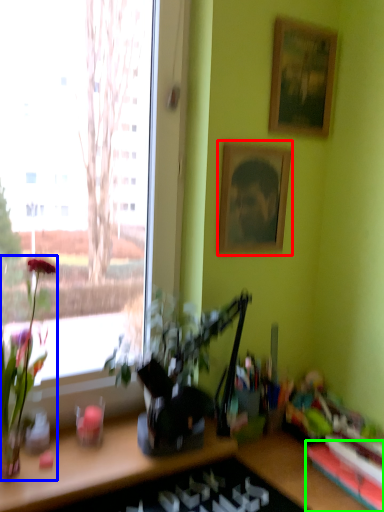
Question: Estimate the real-world distances between objects in this image. Which object is closer to picture frame (highlighted by a red box), houseplant (highlighted by a blue box) or shelf (highlighted by a green box)?

Choices:
 (A) houseplant
 (B) shelf

Answer: (A)